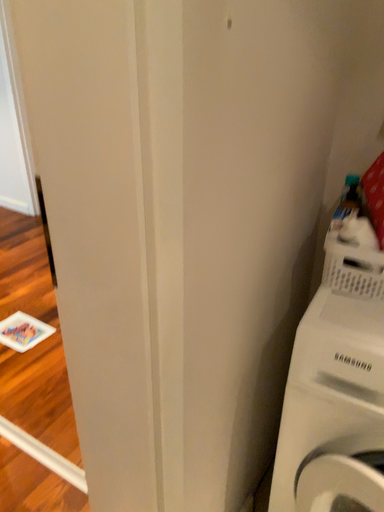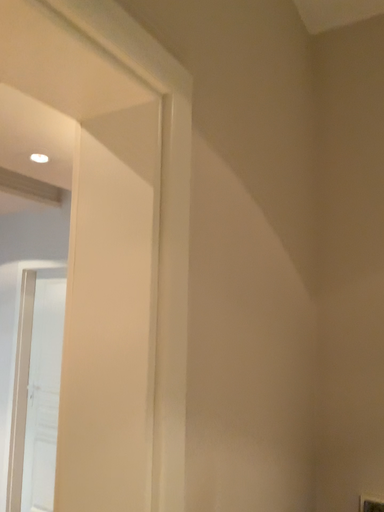
Question: Which way did the camera rotate in the video?

Choices:
 (A) rotated upward
 (B) rotated downward

Answer: (A)